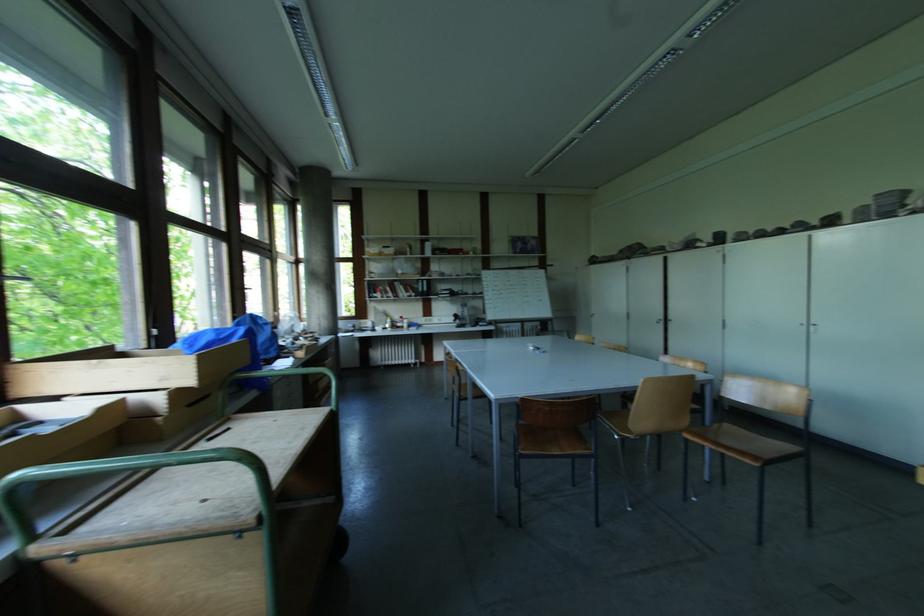
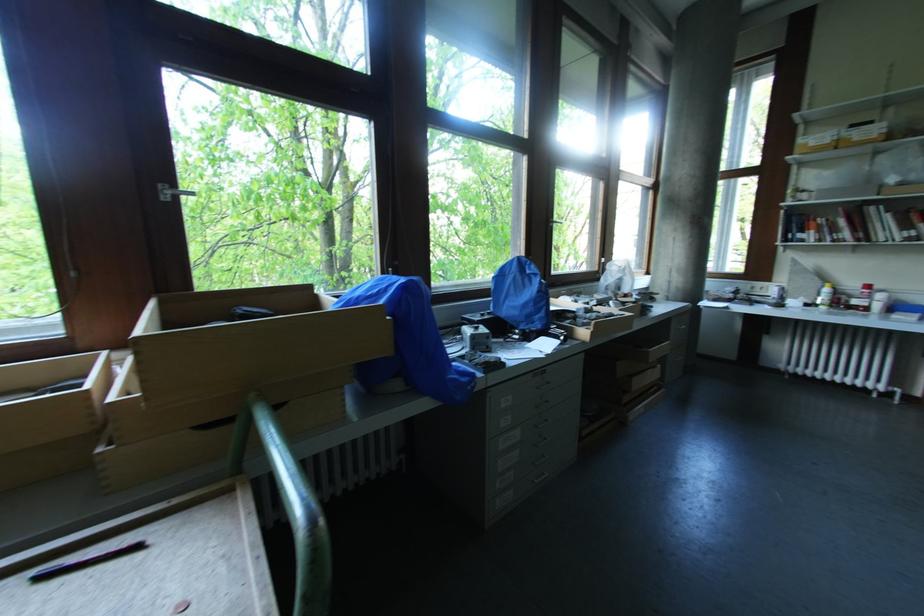
Locate, in the second image, the point that corresponds to point (408, 323) in the first image.

(882, 298)